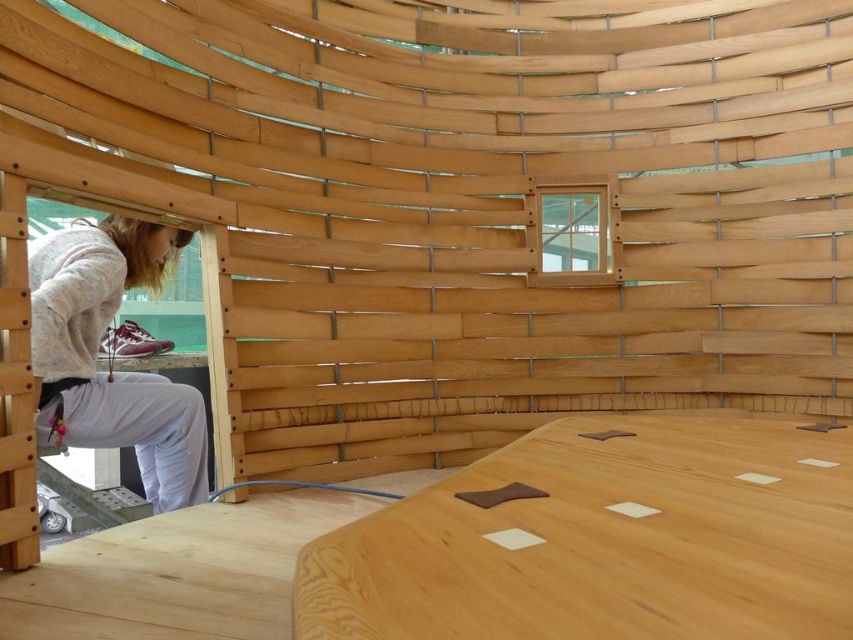
Question: Among these points, which one is nearest to the camera?

Choices:
 (A) tap(157, 476)
 (B) tap(585, 438)

Answer: (B)

Question: Is natural wood table at center below light gray sweater at lower left?

Choices:
 (A) no
 (B) yes

Answer: (B)

Question: Among these points, which one is farthest from the camera?

Choices:
 (A) (341, 531)
 (B) (32, 362)

Answer: (B)

Question: Can you confirm if natural wood table at center is positioned to the left of light gray sweater at lower left?

Choices:
 (A) yes
 (B) no

Answer: (B)

Question: Is natural wood table at center positioned at the back of light gray sweater at lower left?

Choices:
 (A) no
 (B) yes

Answer: (A)

Question: Which point appears closest to the camera in this image?

Choices:
 (A) (84, 228)
 (B) (836, 572)

Answer: (B)